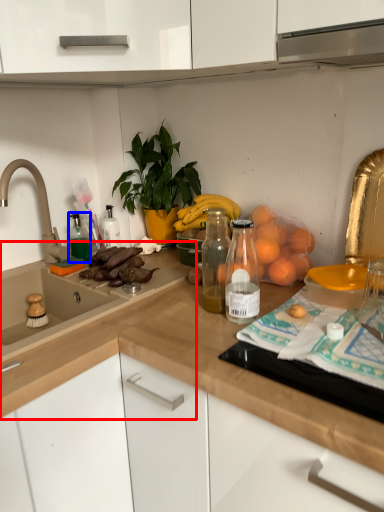
Question: Among these objects, which one is nearest to the camera, countertop (highlighted by a red box) or bottle (highlighted by a blue box)?

Choices:
 (A) countertop
 (B) bottle

Answer: (A)